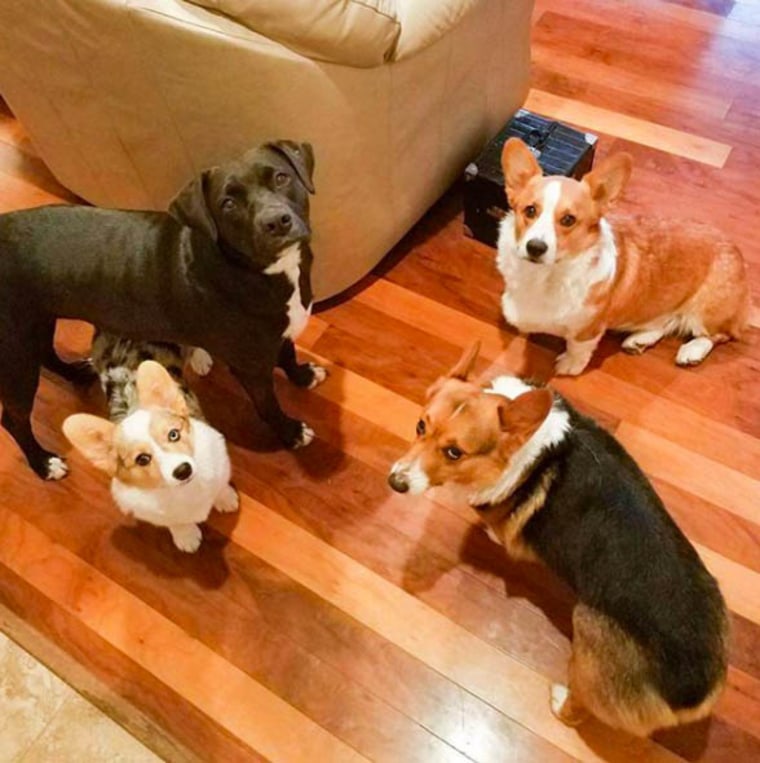
Where is `glow from window`? glow from window is located at coordinates (736, 11).